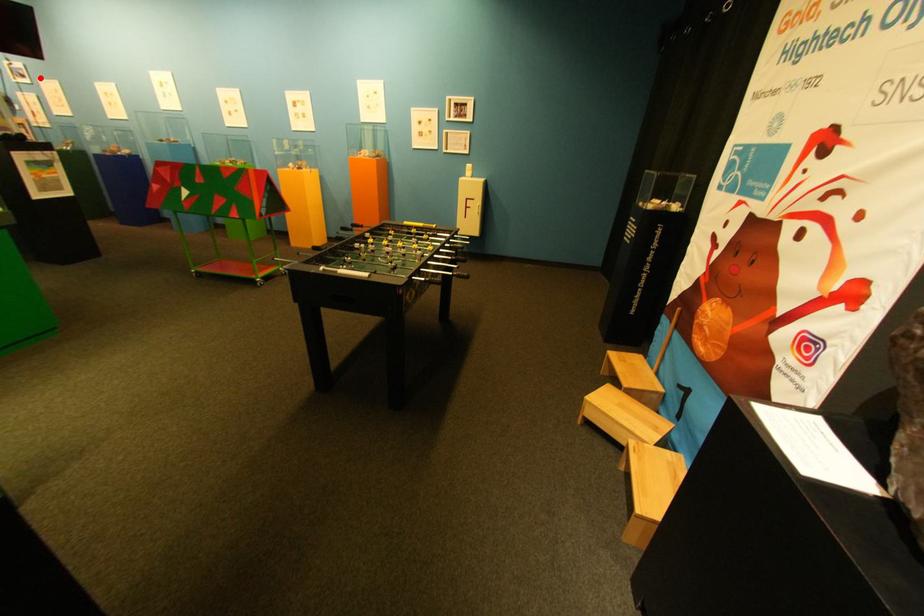
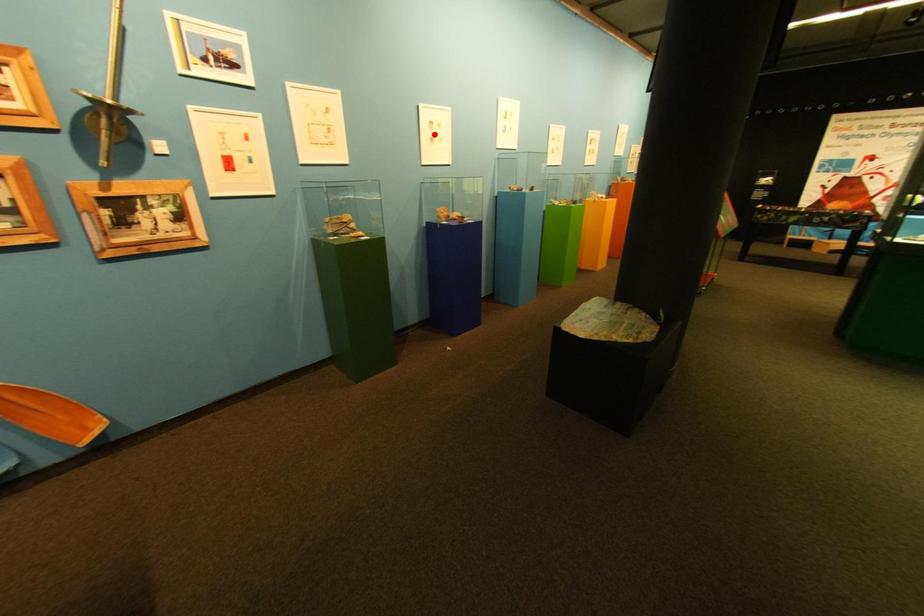
I am providing you with two images of the same scene from different viewpoints. A red point is marked on the first image and another point is marked on the second image. Are the points marked in image1 and image2 representing the same 3D position?

No